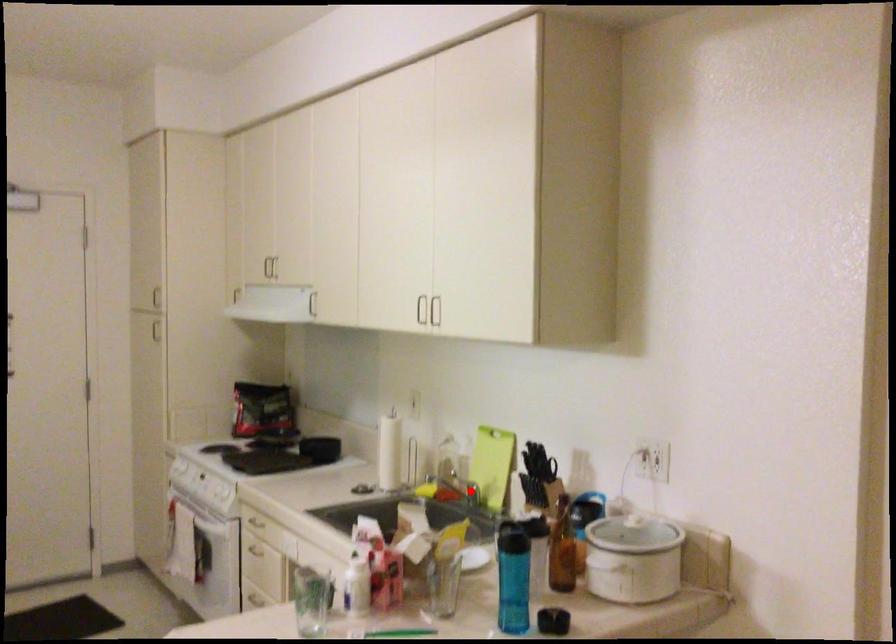
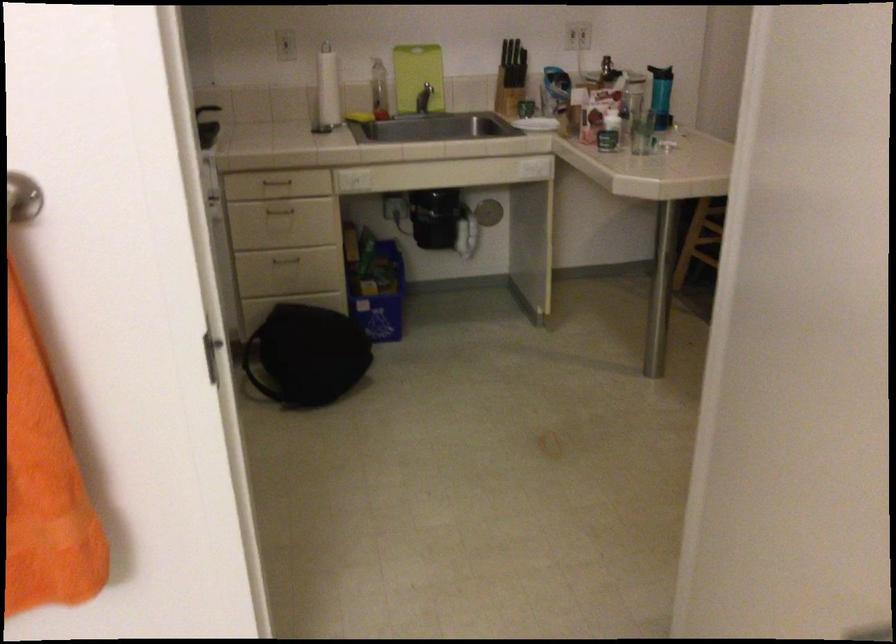
In the second image, find the point that corresponds to the highlighted location in the first image.

(424, 98)